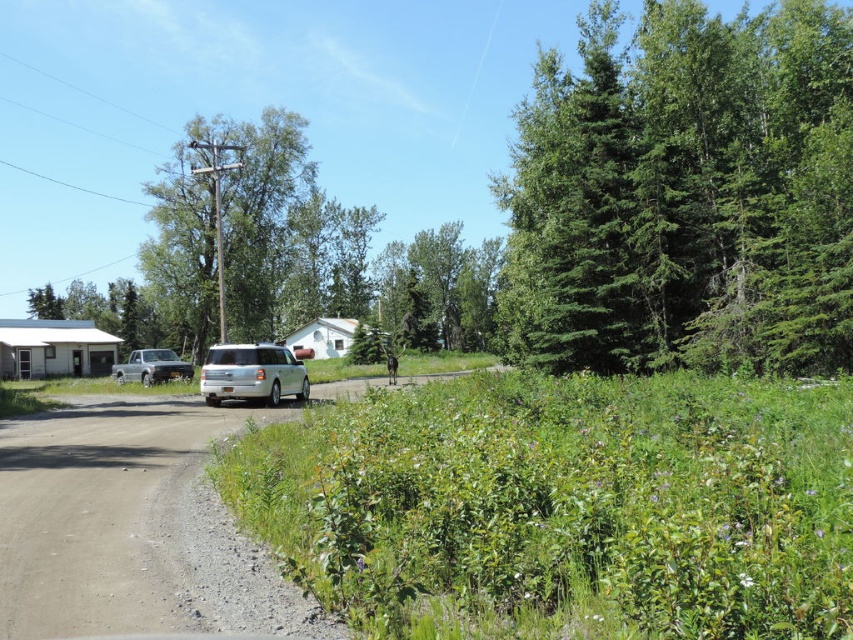
Who is positioned more to the right, green leafy tree at center or silver metallic truck at left?

From the viewer's perspective, silver metallic truck at left appears more on the right side.

Is green leafy tree at center below silver metallic truck at left?

No.

Between point (192, 164) and point (119, 378), which one is positioned behind?

Point (192, 164)

Locate an element on the screen. This screenshot has width=853, height=640. green leafy tree at center is located at coordinates (224, 228).

Does green leafy shrubs at center lie in front of white matte suv at center?

That is True.

Does green leafy shrubs at center appear on the left side of white matte suv at center?

Incorrect, green leafy shrubs at center is not on the left side of white matte suv at center.

Locate an element on the screen. Image resolution: width=853 pixels, height=640 pixels. green leafy shrubs at center is located at coordinates (563, 506).

Which is in front, point (778, 152) or point (231, 141)?

Point (778, 152) is in front.

Which is more to the right, green leafy tree at right or green leafy tree at center?

green leafy tree at right is more to the right.

Which is behind, point (728, 51) or point (291, 198)?

The point (291, 198) is more distant.

I want to click on green leafy tree at right, so (x=683, y=195).